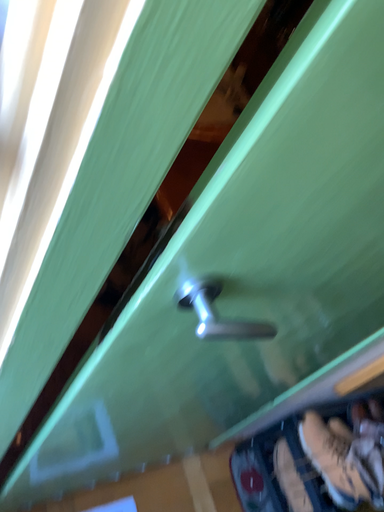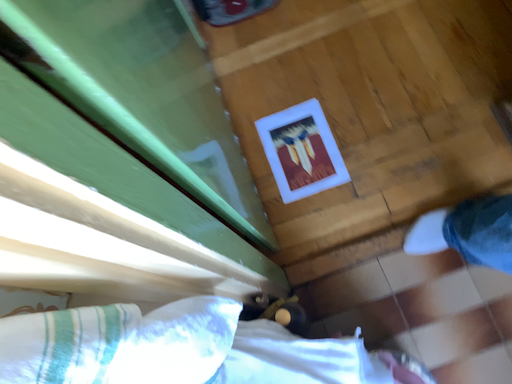
Question: Which way did the camera rotate in the video?

Choices:
 (A) rotated downward
 (B) rotated upward

Answer: (A)